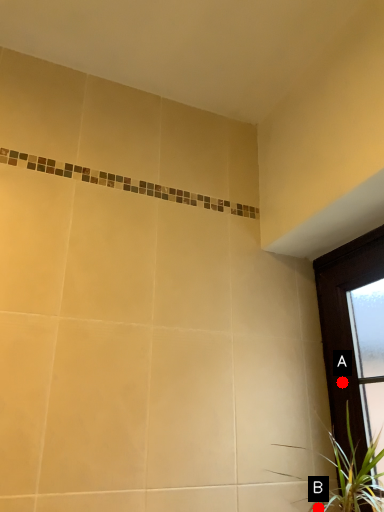
Question: Two points are circled on the image, labeled by A and B beside each circle. Among these points, which one is nearest to the camera?

Choices:
 (A) A is closer
 (B) B is closer

Answer: (B)